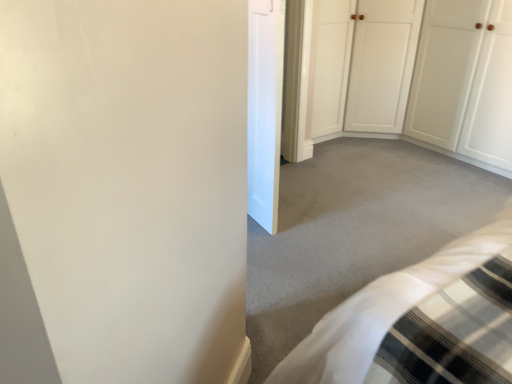
Question: Is white wood door at upper right, acting as the 1th door starting from the back, bigger than white smooth door at center, the 2th door from the back?

Choices:
 (A) no
 (B) yes

Answer: (B)

Question: From the image's perspective, is white wood door at upper right, which is the first door in right-to-left order, below white smooth door at center, the 2th door from the back?

Choices:
 (A) yes
 (B) no

Answer: (B)

Question: From the image's perspective, is white wood door at upper right, acting as the 1th door starting from the back, on top of white smooth door at center, the first door when ordered from left to right?

Choices:
 (A) yes
 (B) no

Answer: (A)

Question: Is white wood door at upper right, the 2th door positioned from the left, oriented towards white smooth door at center, the 2th door from the back?

Choices:
 (A) yes
 (B) no

Answer: (A)

Question: Is white wood door at upper right, acting as the 1th door starting from the back, facing away from white smooth door at center, the 2th door from the back?

Choices:
 (A) no
 (B) yes

Answer: (A)

Question: Is white wood door at upper right, which appears as the 2th door when viewed from the front, far away from white smooth door at center, the first door when ordered from left to right?

Choices:
 (A) no
 (B) yes

Answer: (B)

Question: Can you confirm if white smooth door at center, which is the second door in right-to-left order, is taller than white wood door at upper right, which is the first door in right-to-left order?

Choices:
 (A) yes
 (B) no

Answer: (A)

Question: Does white smooth door at center, which is counted as the first door, starting from the front, have a lesser width compared to white wood door at upper right, which appears as the 2th door when viewed from the front?

Choices:
 (A) no
 (B) yes

Answer: (B)

Question: Is there a large distance between white smooth door at center, which is counted as the first door, starting from the front, and white wood door at upper right, which is the first door in right-to-left order?

Choices:
 (A) no
 (B) yes

Answer: (B)

Question: Does white smooth door at center, the first door when ordered from left to right, have a larger size compared to white wood door at upper right, acting as the 1th door starting from the back?

Choices:
 (A) no
 (B) yes

Answer: (A)

Question: From the image's perspective, is white smooth door at center, the 2th door from the back, on white wood door at upper right, which appears as the 2th door when viewed from the front?

Choices:
 (A) no
 (B) yes

Answer: (A)

Question: Is the depth of white smooth door at center, the 2th door from the back, less than that of white wood door at upper right, which is the first door in right-to-left order?

Choices:
 (A) yes
 (B) no

Answer: (A)

Question: Is white smooth door at center, the 2th door from the back, to the left or to the right of white wood door at upper right, which appears as the 2th door when viewed from the front, in the image?

Choices:
 (A) right
 (B) left

Answer: (B)